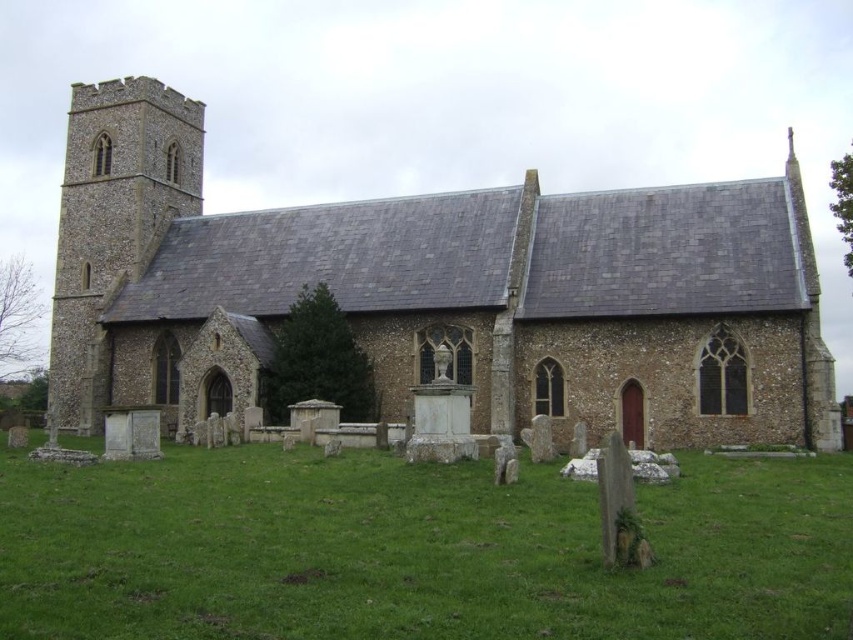
You are standing at the entrance of the traditional stone church and see two points marked in the image. The first point is labeled as point [508,376] and the second is point [202,595]. From your current position, which point is farther away from you?

Point [508,376] is behind point [202,595], so it is farther away from your current position at the entrance of the traditional stone church.